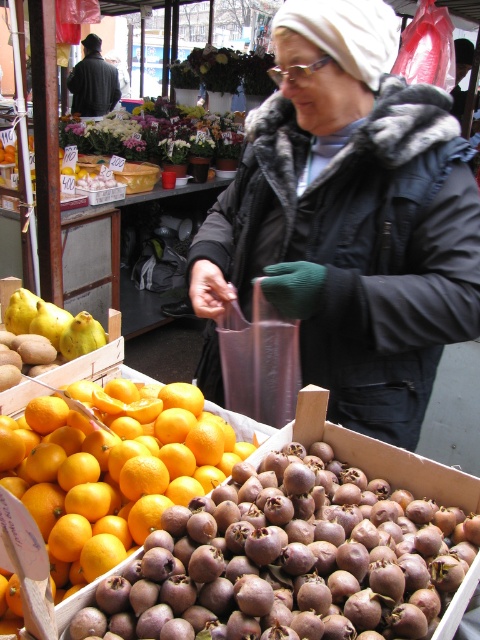
You are a customer at the market stall and want to place a gift box between the brown matte medlar at lower center and the smooth orange at center. The gift box is 10 inches long. Will it fit between them?

The distance between the brown matte medlar at lower center and the smooth orange at center is 9.30 inches. Since the gift box is 10 inches long, it will not fit between them as the space is smaller than the box.